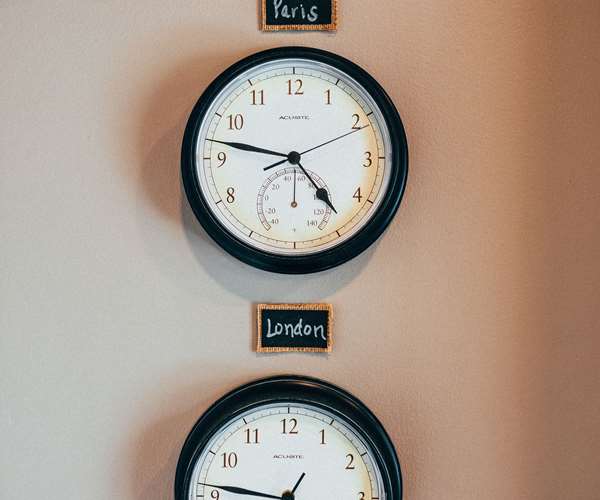
Identify the location of part of clock that fits against wall. This screenshot has height=500, width=600. (396, 193), (360, 412).